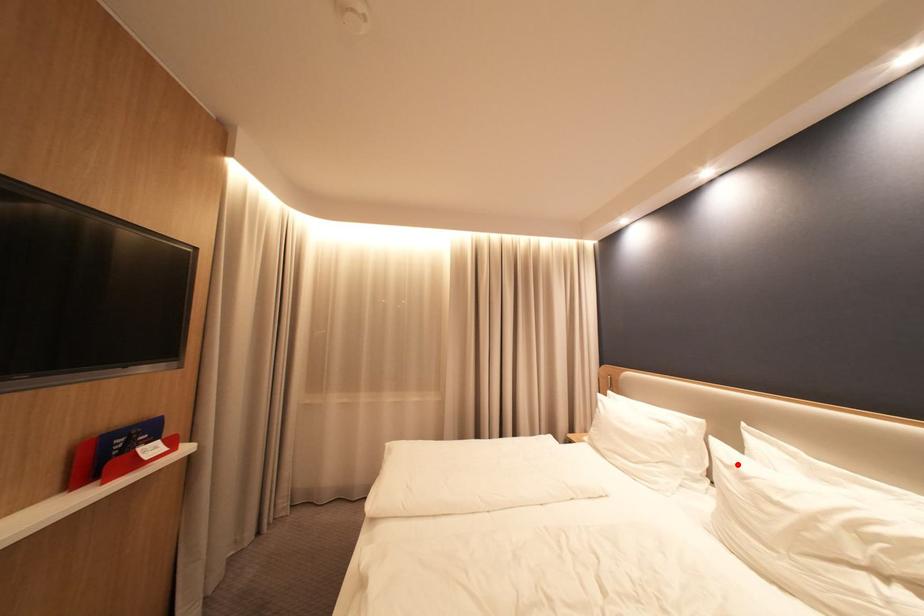
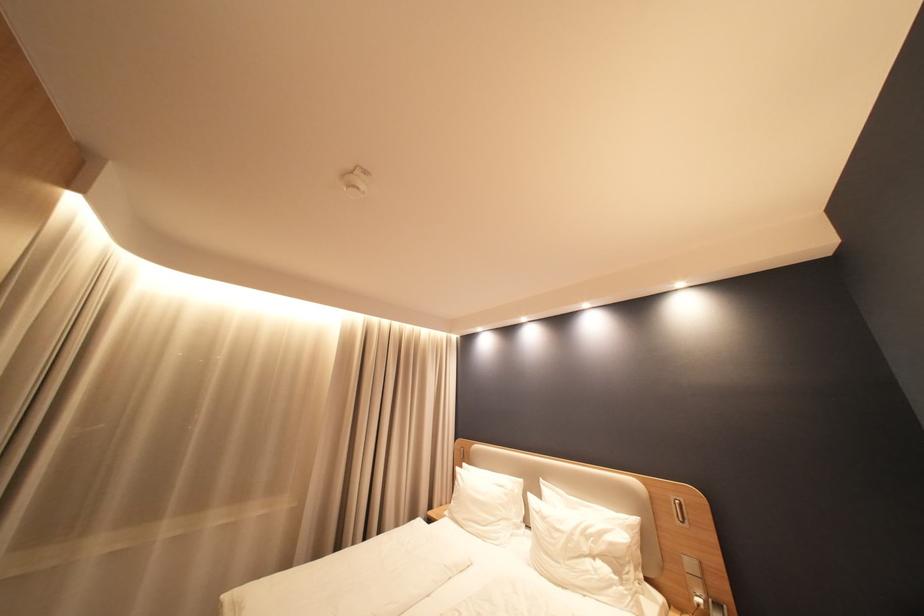
Find the pixel in the second image that matches the highlighted location in the first image.

(546, 511)